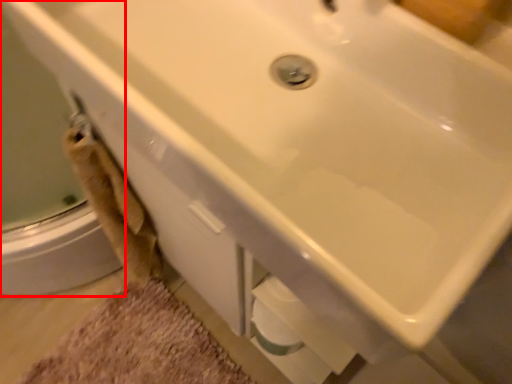
Question: Considering the relative positions of shower door (annotated by the red box) and bath mat in the image provided, where is shower door (annotated by the red box) located with respect to the staircase?

Choices:
 (A) right
 (B) left

Answer: (A)